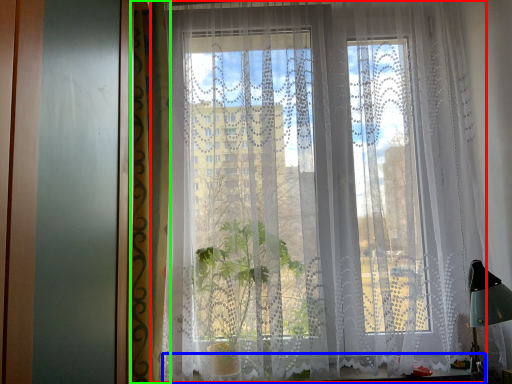
Question: Which object is positioned farthest from curtain (highlighted by a red box)? Select from window sill (highlighted by a blue box) and curtain (highlighted by a green box).

Choices:
 (A) window sill
 (B) curtain

Answer: (A)